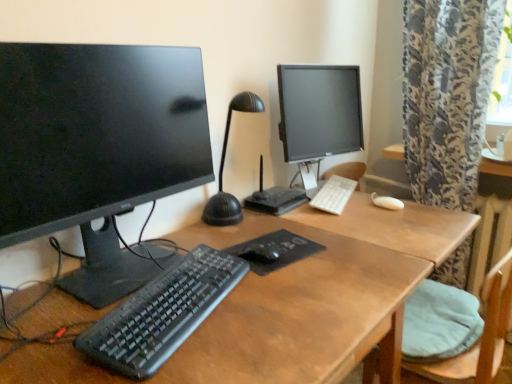
Question: Is point (18, 144) positioned closer to the camera than point (196, 236)?

Choices:
 (A) farther
 (B) closer

Answer: (B)

Question: Based on their positions, is matte black monitor at left, marked as the second computer monitor in a right-to-left arrangement, located to the left or right of wooden desk at center?

Choices:
 (A) right
 (B) left

Answer: (B)

Question: Which of these objects is positioned farthest from the black plastic keyboard at center, which appears as the second computer keyboard when viewed from the right?

Choices:
 (A) black matte mouse at center
 (B) matte black monitor at center, the 1th computer monitor viewed from the back
 (C) matte black monitor at left, the first computer monitor when ordered from left to right
 (D) black textured mousepad at center
 (E) white plastic keyboard at center, the first computer keyboard from the right

Answer: (B)

Question: Which is nearer to the matte black monitor at left, which is the 1th computer monitor from front to back?

Choices:
 (A) black plastic keyboard at center, which appears as the second computer keyboard when viewed from the right
 (B) white plastic keyboard at center, which appears as the second computer keyboard when viewed from the front
 (C) black matte mouse at center
 (D) wooden desk at center
 (E) black textured mousepad at center

Answer: (A)